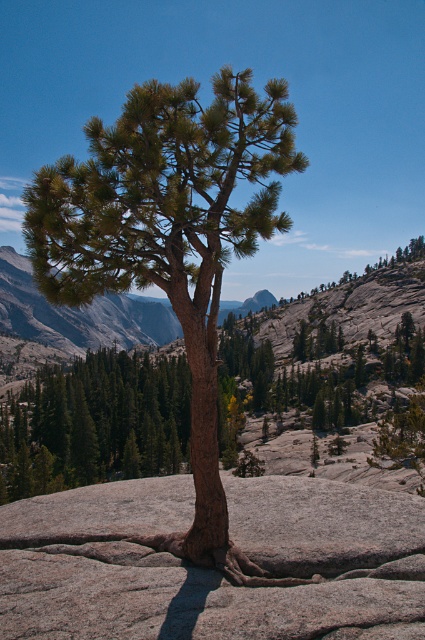
Image resolution: width=425 pixels, height=640 pixels. In order to click on gray rough boulder at center in this screenshot , I will do `click(212, 568)`.

Is point (241, 483) less distant than point (149, 212)?

No, it is behind (149, 212).

Identify the location of gray rough boulder at center. [x=212, y=568].